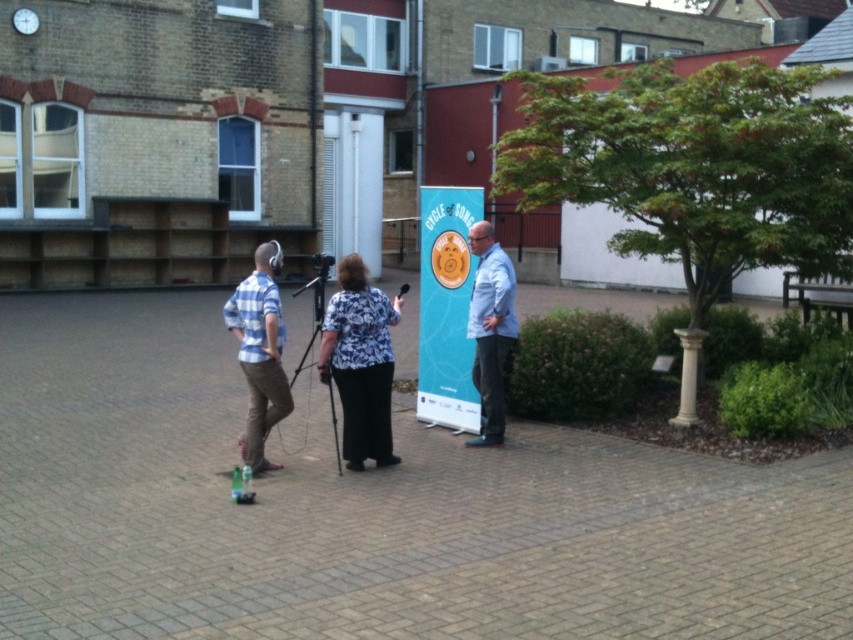
Question: Is plaid shirt at left to the left of blue shirt at center from the viewer's perspective?

Choices:
 (A) no
 (B) yes

Answer: (B)

Question: Which of the following is the farthest from the observer?

Choices:
 (A) black matte microphone at center
 (B) blue shirt at center

Answer: (A)

Question: Can you confirm if blue shirt at center is positioned below black matte microphone at center?

Choices:
 (A) yes
 (B) no

Answer: (A)

Question: Which point is closer to the camera taking this photo?

Choices:
 (A) (302, 362)
 (B) (357, 269)
 (C) (248, 444)

Answer: (C)

Question: Which of the following is the closest to the observer?

Choices:
 (A) (399, 292)
 (B) (508, 324)
 (C) (268, 387)

Answer: (C)

Question: Is blue fabric banner at center bigger than plaid shirt at left?

Choices:
 (A) yes
 (B) no

Answer: (B)